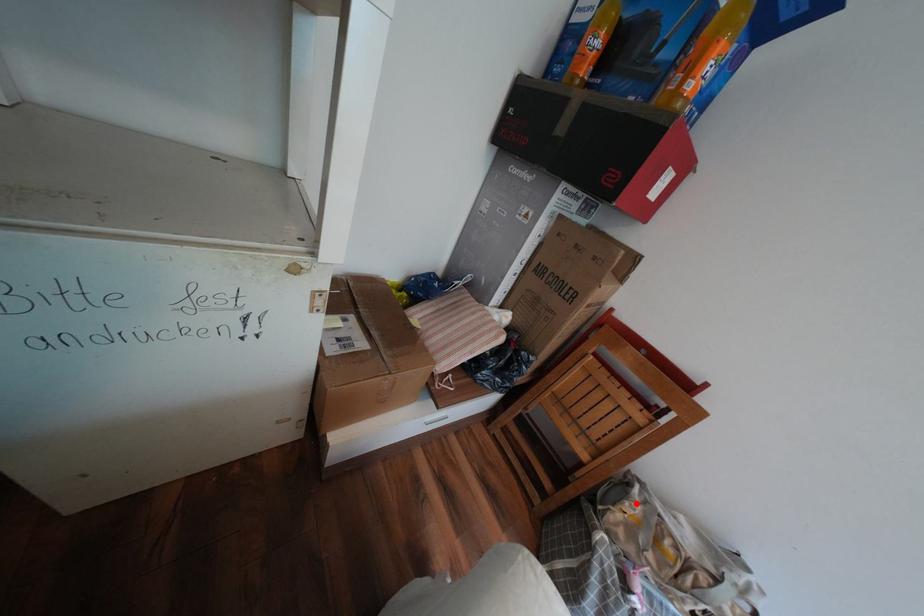
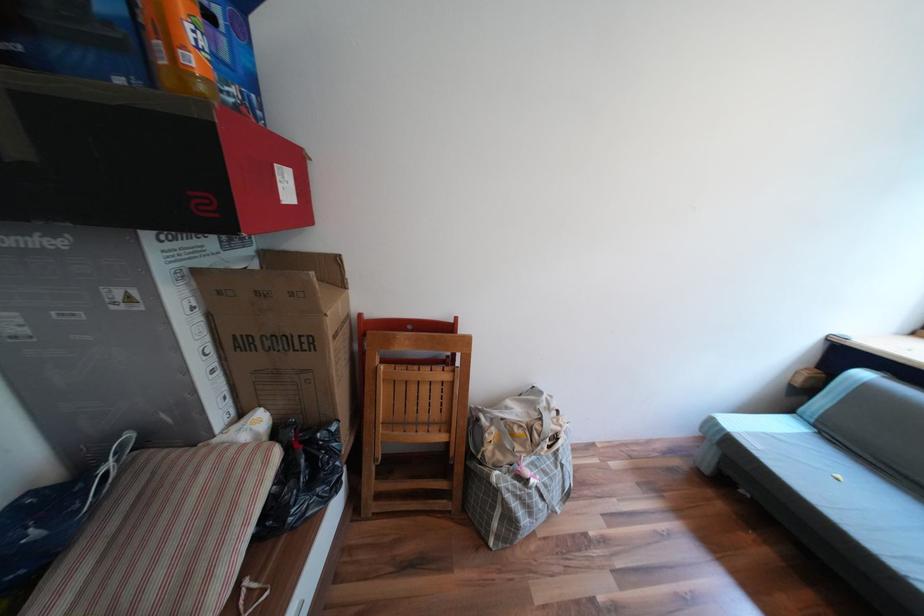
Where in the second image is the point corresponding to the highlighted location from the first image?

(495, 435)